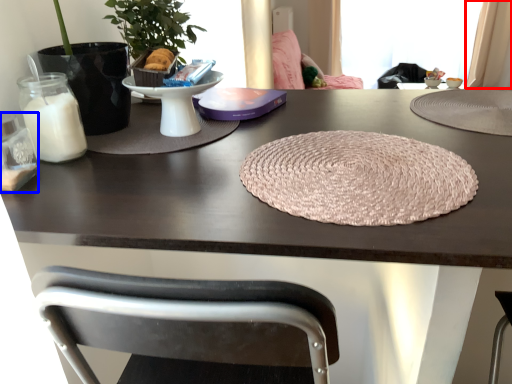
Question: Which point is closer to the camera, curtain (highlighted by a red box) or candle holder (highlighted by a blue box)?

Choices:
 (A) curtain
 (B) candle holder

Answer: (B)